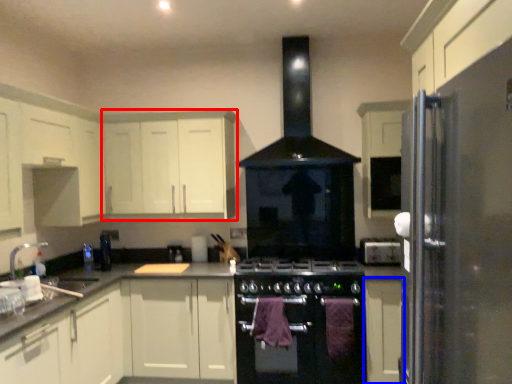
Question: Which object is further to the camera taking this photo, cabinetry (highlighted by a red box) or cabinetry (highlighted by a blue box)?

Choices:
 (A) cabinetry
 (B) cabinetry

Answer: (A)